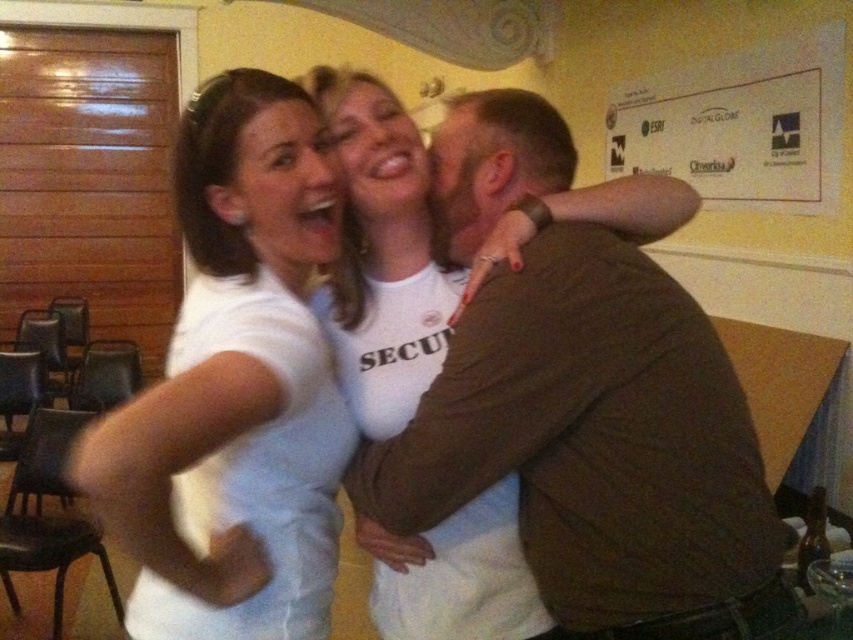
Question: Does white matte t-shirt at center appear over white paper at upper right?

Choices:
 (A) no
 (B) yes

Answer: (A)

Question: Which object is farther from the camera taking this photo?

Choices:
 (A) brown cotton shirt at upper right
 (B) white paper at upper right
 (C) white matte t-shirt at center

Answer: (B)

Question: Which point appears farthest from the camera in this image?

Choices:
 (A) (219, 628)
 (B) (717, 116)
 (C) (625, 346)

Answer: (B)

Question: Does brown cotton shirt at upper right have a larger size compared to white paper at upper right?

Choices:
 (A) no
 (B) yes

Answer: (A)

Question: Which of the following is the farthest from the observer?

Choices:
 (A) white paper at upper right
 (B) white matte t-shirt at center
 (C) brown cotton shirt at upper right

Answer: (A)

Question: Is brown cotton shirt at upper right positioned before white paper at upper right?

Choices:
 (A) no
 (B) yes

Answer: (B)